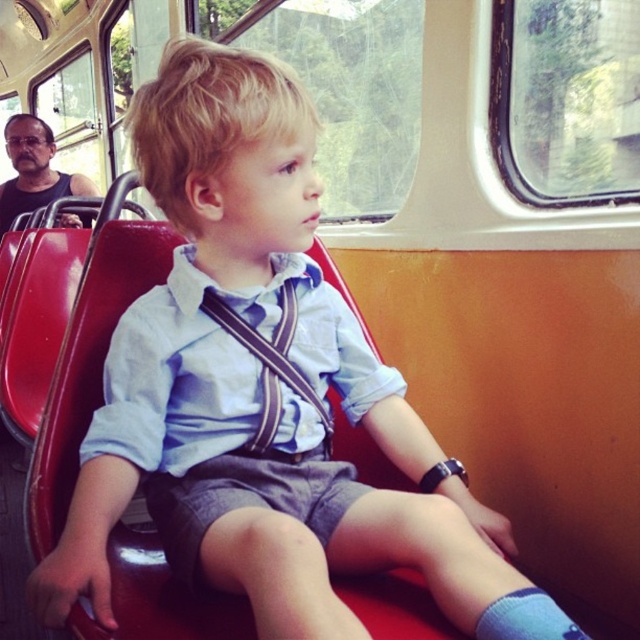
Can you confirm if striped fabric suspenders at center is wider than black tank top at left?

No.

Between striped fabric suspenders at center and black tank top at left, which one is positioned higher?

black tank top at left is higher up.

Does point (234, 314) lie behind point (20, 124)?

No, it is in front of (20, 124).

This screenshot has width=640, height=640. I want to click on striped fabric suspenders at center, so (269, 364).